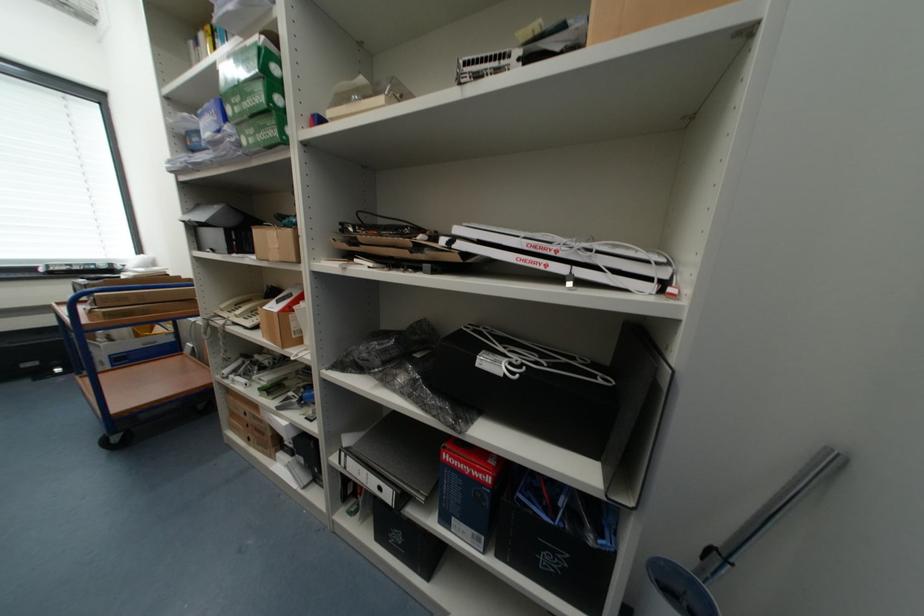
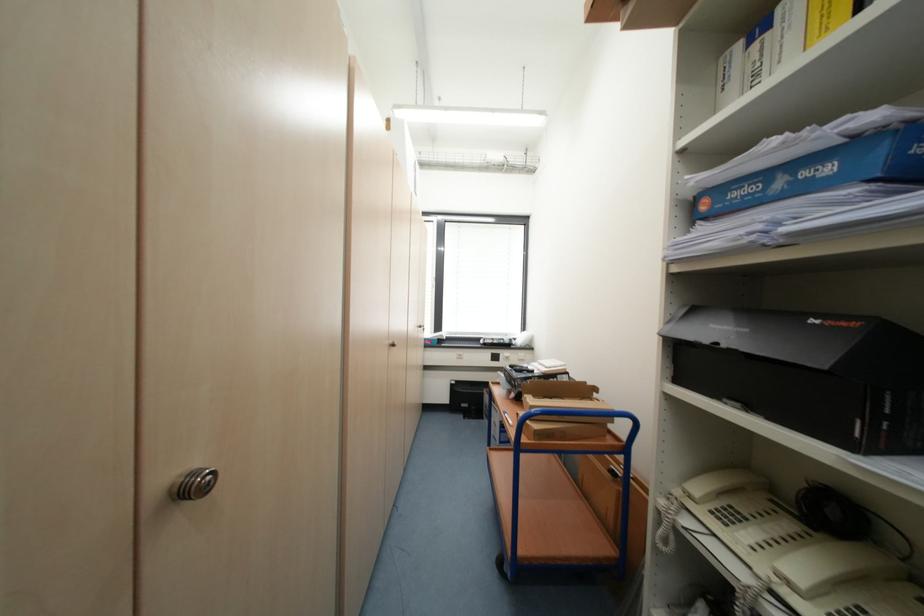
Where in the second image is the point corresponding to [116,315] from the first image?

(544, 436)